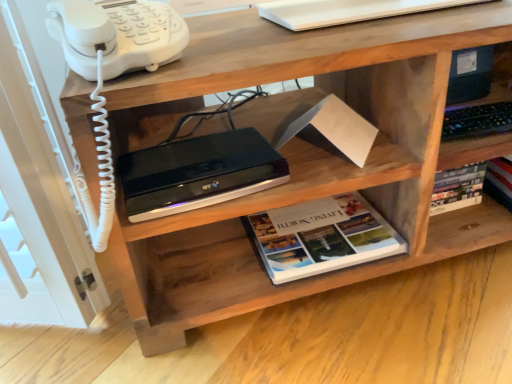
Question: Can you confirm if white plastic phone at upper left is shorter than black plastic printer at upper center?

Choices:
 (A) yes
 (B) no

Answer: (B)

Question: Does white plastic phone at upper left have a smaller size compared to black plastic printer at upper center?

Choices:
 (A) no
 (B) yes

Answer: (A)

Question: From a real-world perspective, is white plastic phone at upper left over black plastic printer at upper center?

Choices:
 (A) yes
 (B) no

Answer: (A)

Question: Is white plastic phone at upper left located outside black plastic printer at upper center?

Choices:
 (A) no
 (B) yes

Answer: (B)

Question: Can you confirm if white plastic phone at upper left is bigger than black plastic printer at upper center?

Choices:
 (A) yes
 (B) no

Answer: (A)

Question: From their relative heights in the image, would you say white plastic phone at upper left is taller or shorter than black plastic printer at upper center?

Choices:
 (A) short
 (B) tall

Answer: (B)

Question: Is white plastic phone at upper left inside or outside of black plastic printer at upper center?

Choices:
 (A) outside
 (B) inside

Answer: (A)

Question: From the image's perspective, is white plastic phone at upper left located above or below black plastic printer at upper center?

Choices:
 (A) above
 (B) below

Answer: (A)

Question: In terms of size, does white plastic phone at upper left appear bigger or smaller than black plastic printer at upper center?

Choices:
 (A) big
 (B) small

Answer: (A)

Question: Based on their sizes in the image, would you say black plastic printer at upper center is bigger or smaller than white plastic phone at upper left?

Choices:
 (A) small
 (B) big

Answer: (A)

Question: From the image's perspective, relative to white plastic phone at upper left, is black plastic printer at upper center above or below?

Choices:
 (A) above
 (B) below

Answer: (B)

Question: Is point (224, 160) positioned closer to the camera than point (124, 62)?

Choices:
 (A) closer
 (B) farther

Answer: (B)

Question: In terms of height, does black plastic printer at upper center look taller or shorter compared to white plastic phone at upper left?

Choices:
 (A) tall
 (B) short

Answer: (B)

Question: Do you think white plastic phone at upper left is within hardcover book at center, or outside of it?

Choices:
 (A) inside
 (B) outside

Answer: (B)

Question: From a real-world perspective, is white plastic phone at upper left positioned above or below hardcover book at center?

Choices:
 (A) above
 (B) below

Answer: (A)